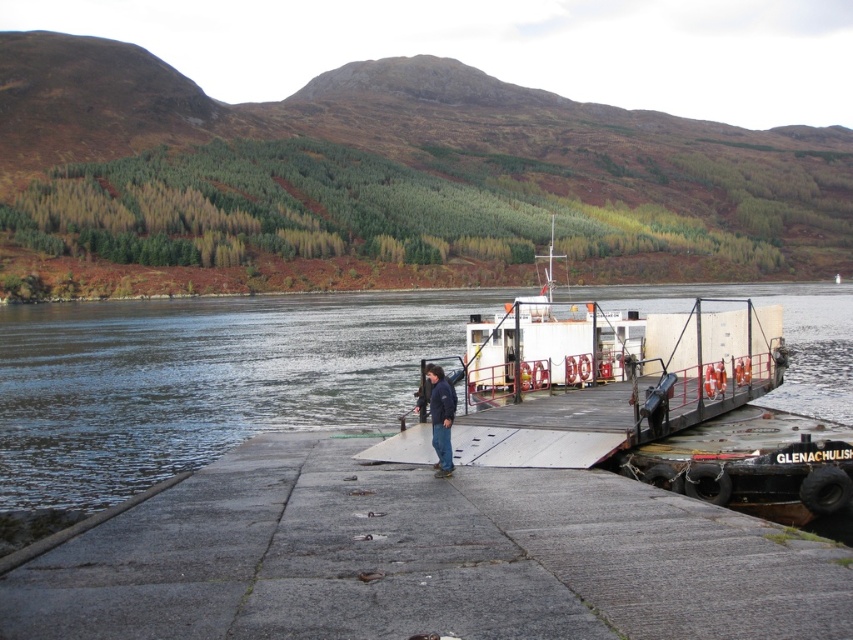
Question: Which point is closer to the camera?

Choices:
 (A) dark blue jacket at center
 (B) gray concrete dock at center

Answer: (B)

Question: Estimate the real-world distances between objects in this image. Which object is farther from the gray concrete dock at center?

Choices:
 (A) clear water at dock center
 (B) dark blue jacket at center

Answer: (A)

Question: Is clear water at dock center thinner than dark blue jacket at center?

Choices:
 (A) no
 (B) yes

Answer: (A)

Question: In this image, where is clear water at dock center located relative to dark blue jacket at center?

Choices:
 (A) right
 (B) left

Answer: (A)

Question: Is clear water at dock center smaller than dark blue jacket at center?

Choices:
 (A) no
 (B) yes

Answer: (A)

Question: Based on their relative distances, which object is nearer to the clear water at dock center?

Choices:
 (A) gray concrete dock at center
 (B) dark blue jacket at center

Answer: (A)